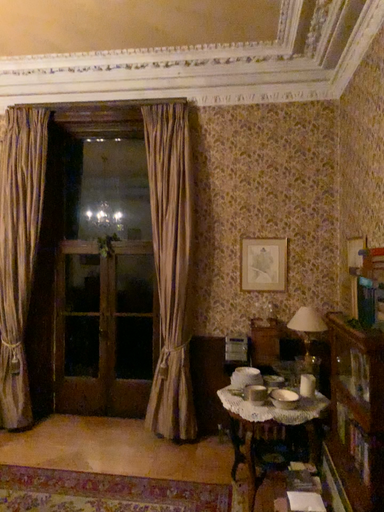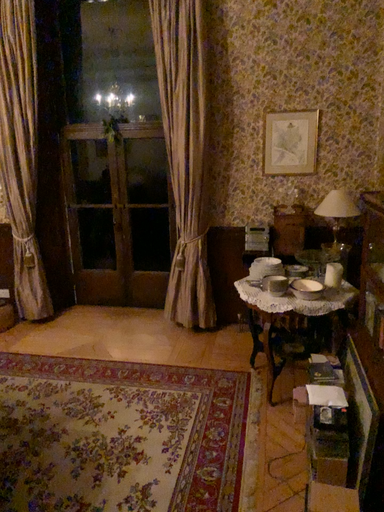
Question: Which way did the camera rotate in the video?

Choices:
 (A) rotated downward
 (B) rotated upward

Answer: (A)